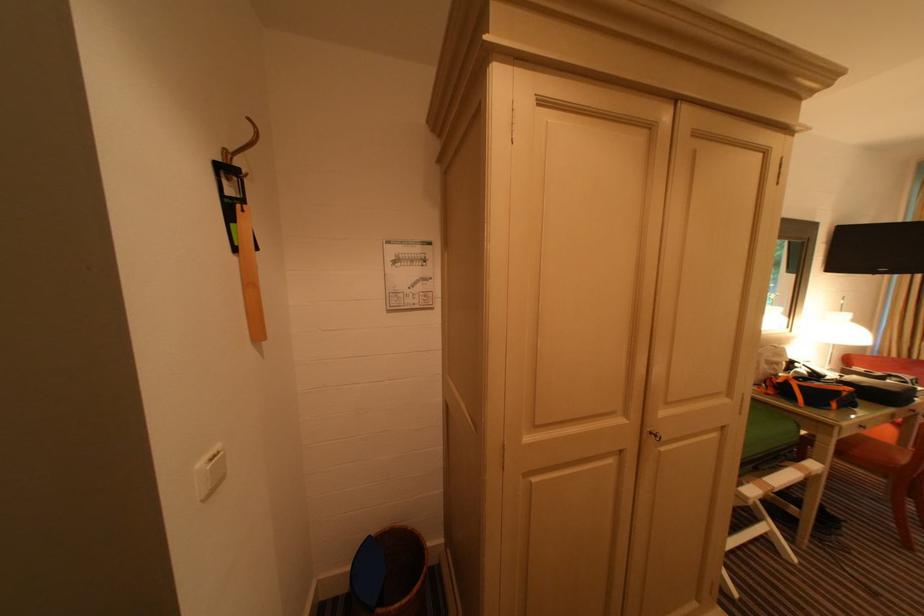
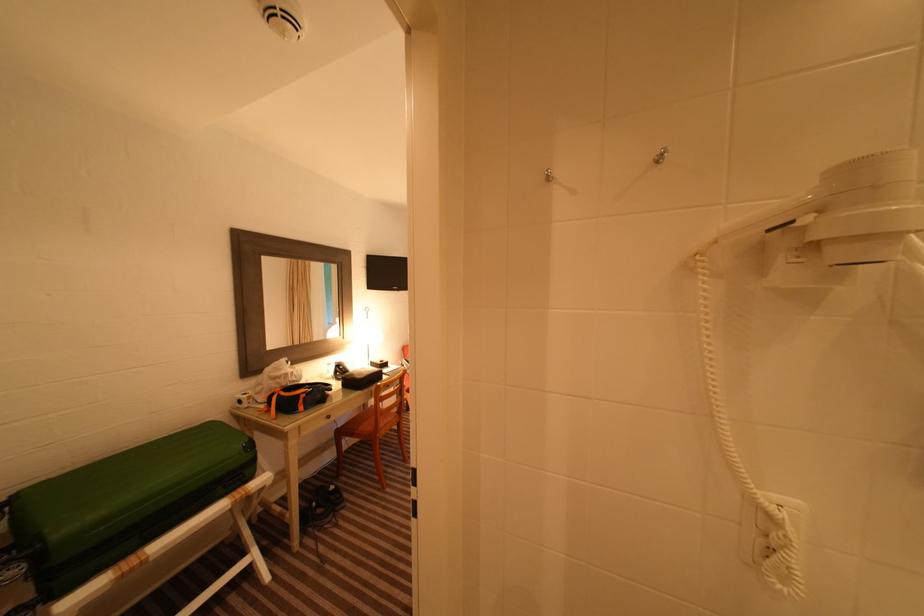
In the second image, find the point that corresponds to [793,383] in the first image.

(280, 397)